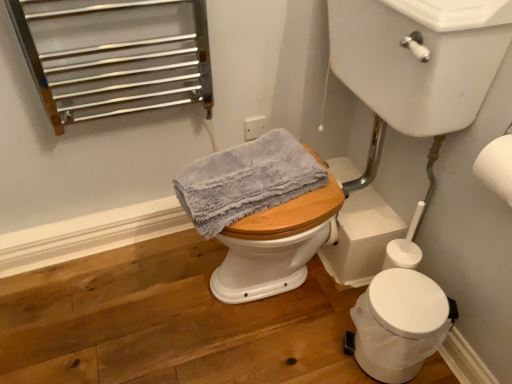
What are the coordinates of `free space between white glossy sink at upper right and white plastic trash can at lower right` in the screenshot? It's located at (308, 359).